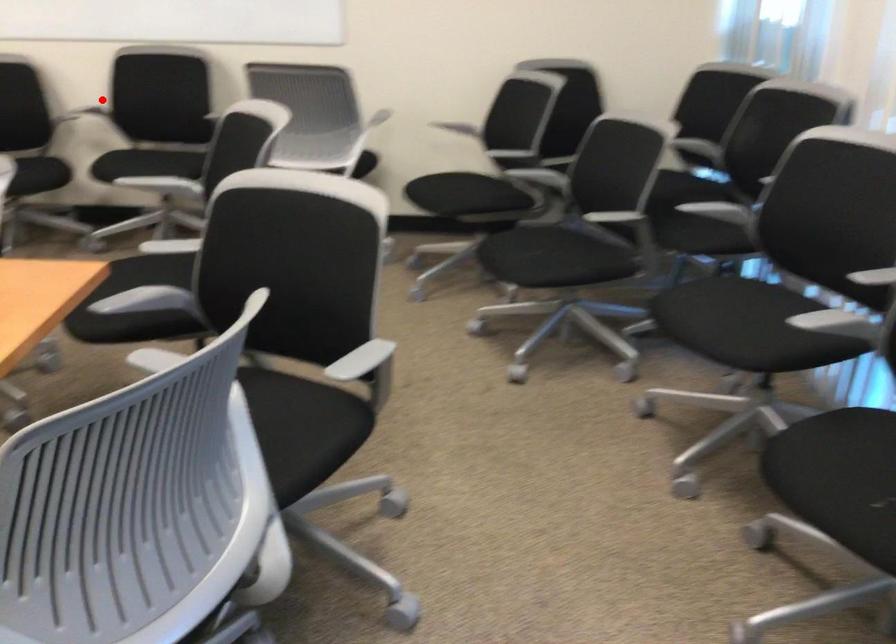
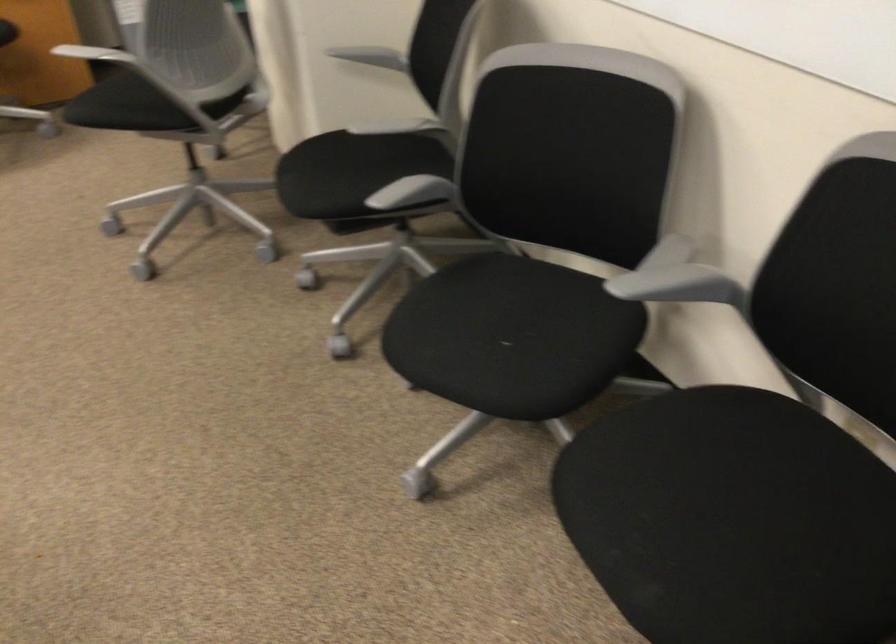
The point at the highlighted location is marked in the first image. Where is the corresponding point in the second image?

(677, 279)